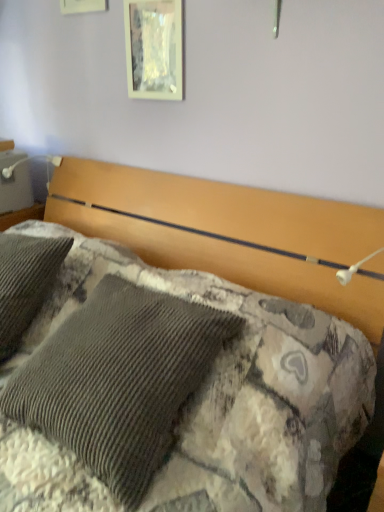
Question: Which direction should I rotate to look at metallic glass picture frame at upper center?

Choices:
 (A) left
 (B) right

Answer: (A)

Question: Is corduroy fabric bed at center far away from metallic glass picture frame at upper center?

Choices:
 (A) yes
 (B) no

Answer: (B)

Question: From the image's perspective, does corduroy fabric bed at center appear higher than metallic glass picture frame at upper center?

Choices:
 (A) yes
 (B) no

Answer: (B)

Question: Does corduroy fabric bed at center have a greater height compared to metallic glass picture frame at upper center?

Choices:
 (A) no
 (B) yes

Answer: (B)

Question: Is corduroy fabric bed at center outside metallic glass picture frame at upper center?

Choices:
 (A) yes
 (B) no

Answer: (A)

Question: Is corduroy fabric bed at center to the right of metallic glass picture frame at upper center from the viewer's perspective?

Choices:
 (A) no
 (B) yes

Answer: (A)

Question: From the image's perspective, is corduroy fabric bed at center located beneath metallic glass picture frame at upper center?

Choices:
 (A) no
 (B) yes

Answer: (B)

Question: Does metallic glass picture frame at upper center have a smaller size compared to corduroy fabric bed at center?

Choices:
 (A) no
 (B) yes

Answer: (B)

Question: Is metallic glass picture frame at upper center taller than corduroy fabric bed at center?

Choices:
 (A) no
 (B) yes

Answer: (A)

Question: Considering the relative positions of metallic glass picture frame at upper center and corduroy fabric bed at center in the image provided, is metallic glass picture frame at upper center to the left of corduroy fabric bed at center from the viewer's perspective?

Choices:
 (A) yes
 (B) no

Answer: (B)

Question: Is metallic glass picture frame at upper center thinner than corduroy fabric bed at center?

Choices:
 (A) no
 (B) yes

Answer: (B)

Question: Are metallic glass picture frame at upper center and corduroy fabric bed at center making contact?

Choices:
 (A) no
 (B) yes

Answer: (A)

Question: Is corduroy fabric bed at center at the back of metallic glass picture frame at upper center?

Choices:
 (A) yes
 (B) no

Answer: (B)

Question: Is point (233, 234) positioned closer to the camera than point (127, 41)?

Choices:
 (A) farther
 (B) closer

Answer: (B)